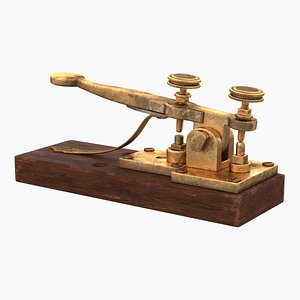
What are the coordinates of `knob` in the screenshot? It's located at (252, 94), (185, 80).